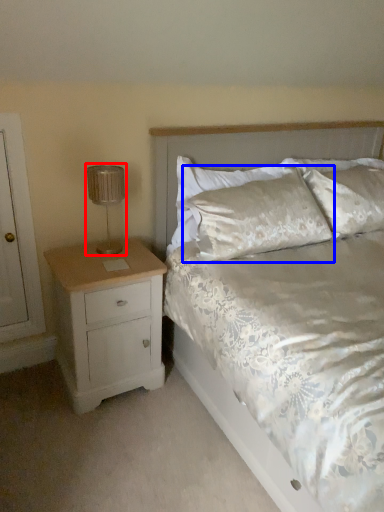
Question: Among these objects, which one is farthest to the camera, lamp (highlighted by a red box) or pillow (highlighted by a blue box)?

Choices:
 (A) lamp
 (B) pillow

Answer: (B)